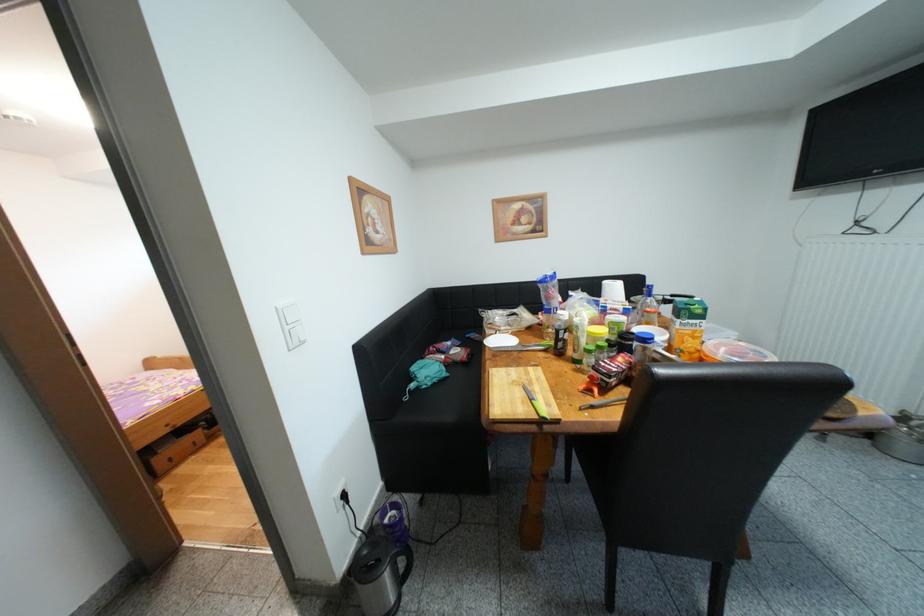
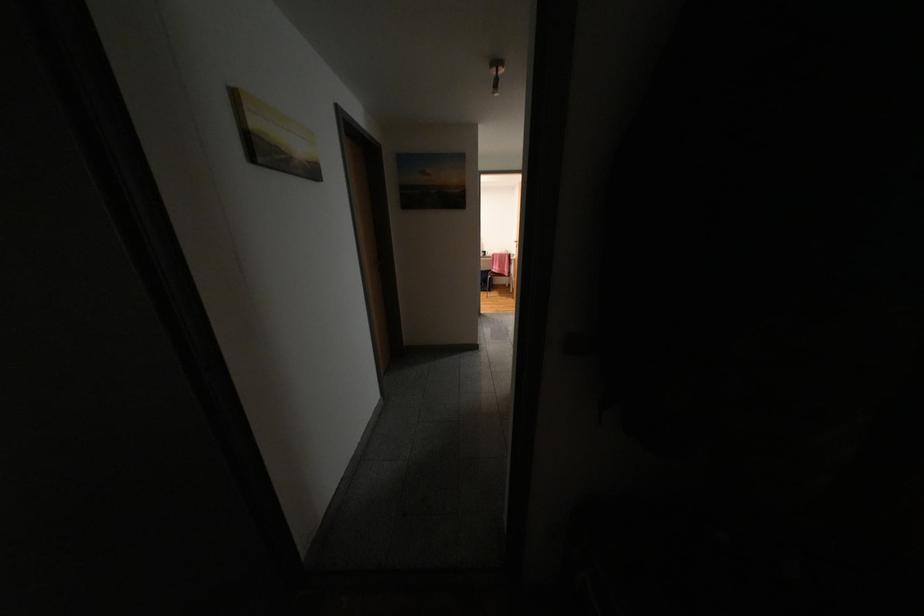
In a continuous first-person perspective shot, in which direction is the camera moving?

The movement direction of the cameraman is left, backward.